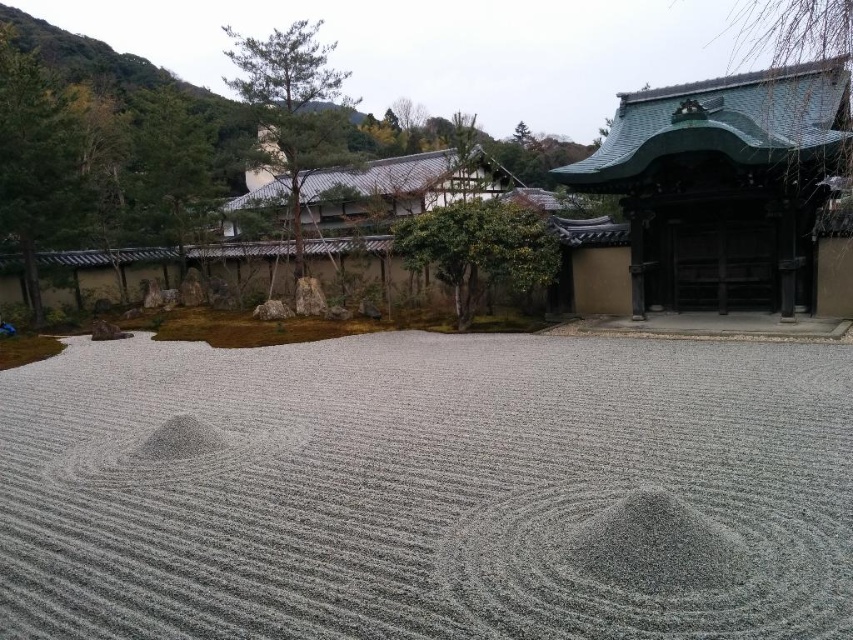
You are standing in the Japanese Zen garden and want to place a small decorative stone at the point marked by coordinates point (x=427, y=490). Based on the garden layout, what surface will the stone be placed on?

The point (x=427, y=490) is on gray gravel at center, so the stone will be placed on the gray gravel at center.

You are standing at the entrance of the Japanese Zen garden and want to walk directly towards the gray gravel at center. According to the coordinates provided, what are the exact coordinates where you should aim to step on?

The gray gravel at center is located at coordinates point (427, 490).

You are designing a miniature model of this Zen garden and need to prioritize space for the gray gravel at center and the green tiled roof at upper right. Which object should you allocate more space to in your model?

The green tiled roof at upper right requires more space in the model because it occupies a larger area than the gray gravel at center in the original scene.